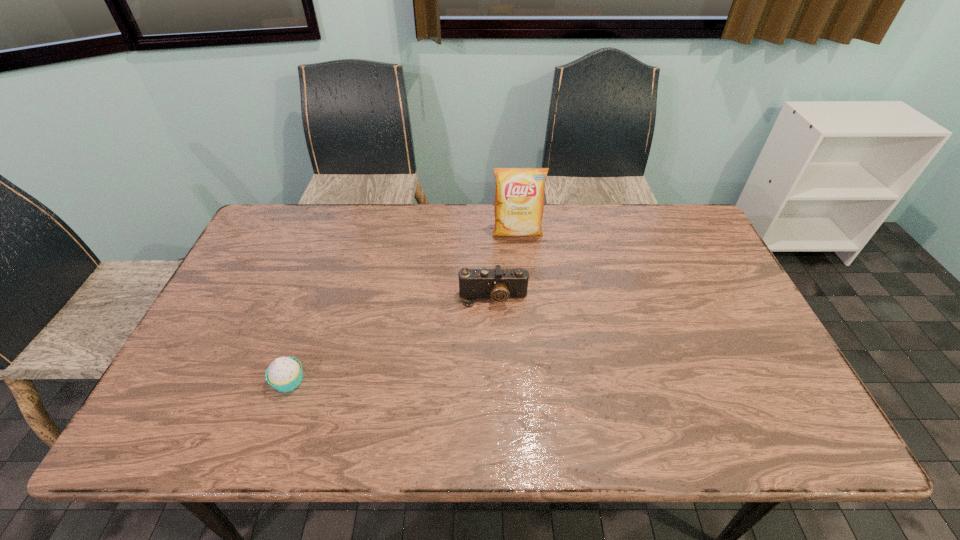
Identify the location of free spot between the second farthest object and the cupcake. The width and height of the screenshot is (960, 540). (391, 339).

The width and height of the screenshot is (960, 540). Find the location of `vacant space that is in between the tallest object and the leftmost object`. vacant space that is in between the tallest object and the leftmost object is located at coordinates (403, 307).

I want to click on free space between the leftmost object and the second farthest object, so click(391, 339).

Locate an element on the screen. free space between the cupcake and the crisp (potato chip) is located at coordinates (403, 307).

Where is `free area in between the crisp (potato chip) and the camera`? free area in between the crisp (potato chip) and the camera is located at coordinates pos(505,265).

Choose which object is the second nearest neighbor to the crisp (potato chip). Please provide its 2D coordinates. Your answer should be formatted as a tuple, i.e. [(x, y)], where the tuple contains the x and y coordinates of a point satisfying the conditions above.

[(284, 374)]

Identify the location of object that stands as the closest to the second nearest object. Image resolution: width=960 pixels, height=540 pixels. 519,196.